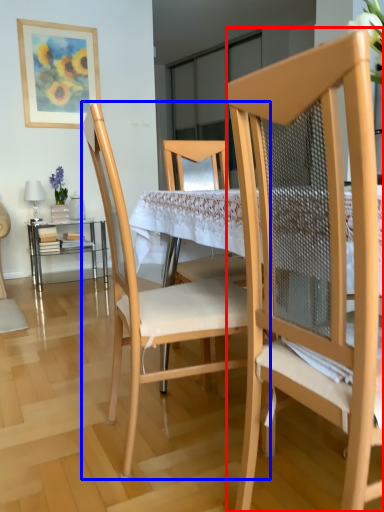
Question: Which point is further to the camera, chair (highlighted by a red box) or chair (highlighted by a blue box)?

Choices:
 (A) chair
 (B) chair

Answer: (B)